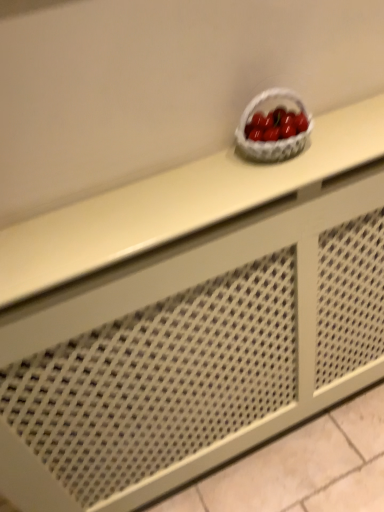
The width and height of the screenshot is (384, 512). What are the coordinates of `vacant region to the left of white textured basket at upper center` in the screenshot? It's located at click(192, 181).